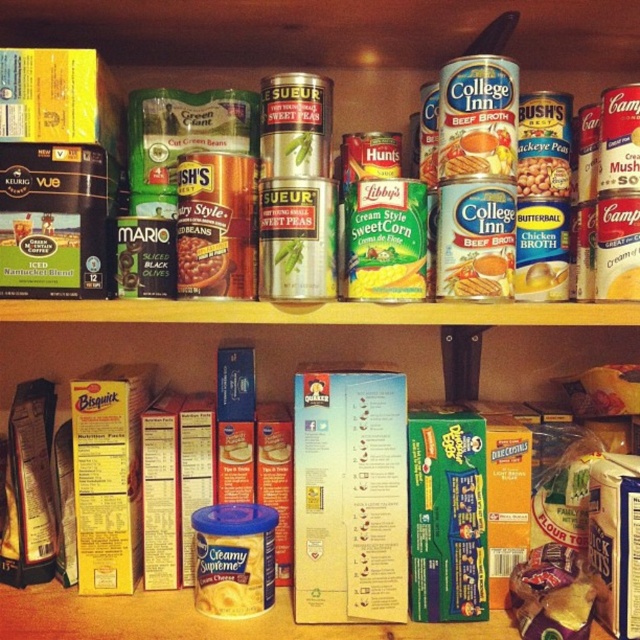
Question: Which object is positioned closest to the matte black olives at center?

Choices:
 (A) matte gold can at center right
 (B) matte yellow can at right

Answer: (A)

Question: Which of the following is the closest to the observer?

Choices:
 (A) matte gold can at center right
 (B) matte yellow can at right

Answer: (B)

Question: Does matte gold can at center right appear over matte yellow can at right?

Choices:
 (A) no
 (B) yes

Answer: (B)

Question: Does matte black olives at center appear on the left side of matte gold can at center right?

Choices:
 (A) yes
 (B) no

Answer: (A)

Question: Which object appears farthest from the camera in this image?

Choices:
 (A) matte gold can at center right
 (B) matte black olives at center
 (C) matte yellow can at right

Answer: (A)

Question: From the image, what is the correct spatial relationship of matte black olives at center in relation to matte yellow can at right?

Choices:
 (A) below
 (B) above

Answer: (B)